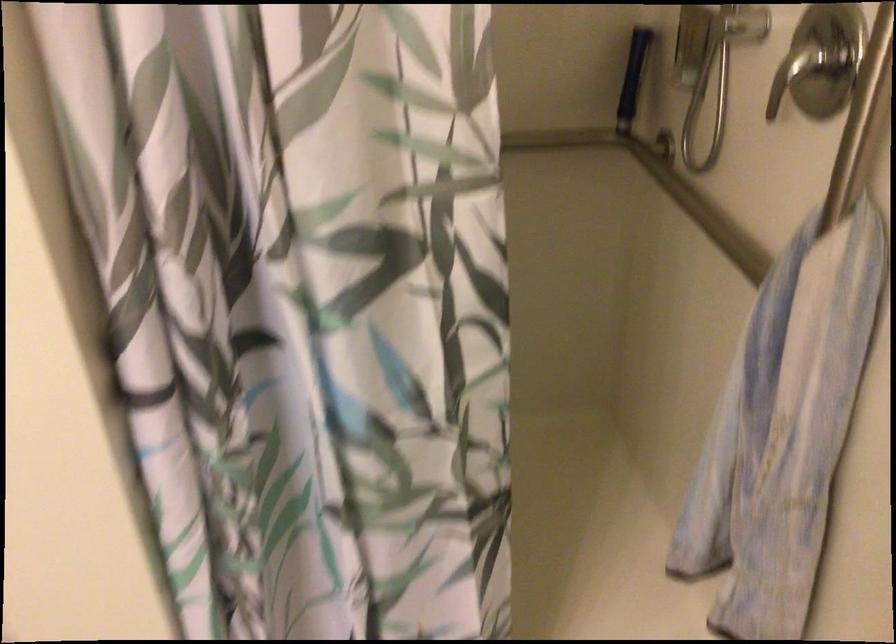
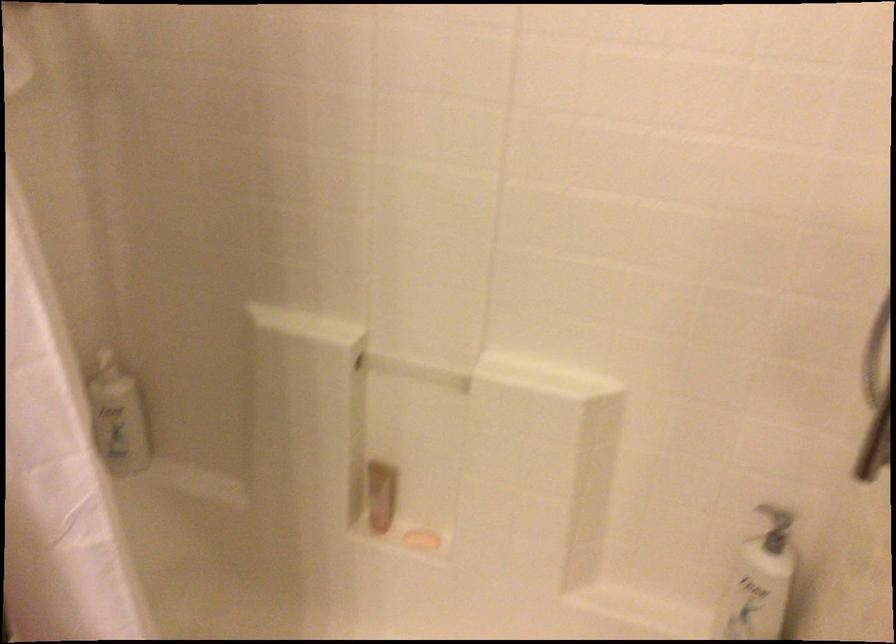
Question: The camera is either moving clockwise (left) or counter-clockwise (right) around the object. The first image is from the beginning of the video and the second image is from the end. Is the camera moving left or right when shooting the video?

Choices:
 (A) Left
 (B) Right

Answer: (B)